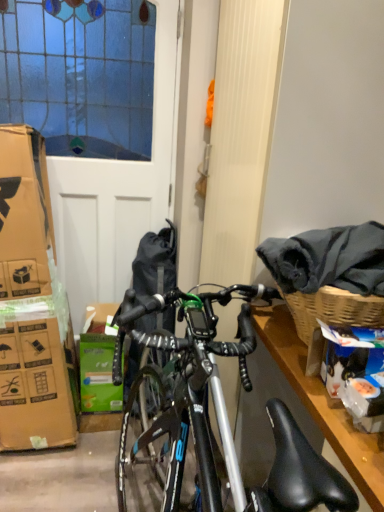
Question: Considering the positions of green cardboard box at center and white matte screen door at left in the image, is green cardboard box at center taller or shorter than white matte screen door at left?

Choices:
 (A) short
 (B) tall

Answer: (A)

Question: Does point (82, 374) appear closer or farther from the camera than point (102, 198)?

Choices:
 (A) farther
 (B) closer

Answer: (B)

Question: In terms of size, does green cardboard box at center appear bigger or smaller than white matte screen door at left?

Choices:
 (A) small
 (B) big

Answer: (A)

Question: In terms of width, does white matte screen door at left look wider or thinner when compared to green cardboard box at center?

Choices:
 (A) wide
 (B) thin

Answer: (B)

Question: From the image's perspective, is white matte screen door at left above or below green cardboard box at center?

Choices:
 (A) above
 (B) below

Answer: (A)

Question: Considering the relative positions of white matte screen door at left and green cardboard box at center in the image provided, is white matte screen door at left to the left or to the right of green cardboard box at center?

Choices:
 (A) left
 (B) right

Answer: (A)

Question: Is white matte screen door at left taller or shorter than green cardboard box at center?

Choices:
 (A) short
 (B) tall

Answer: (B)